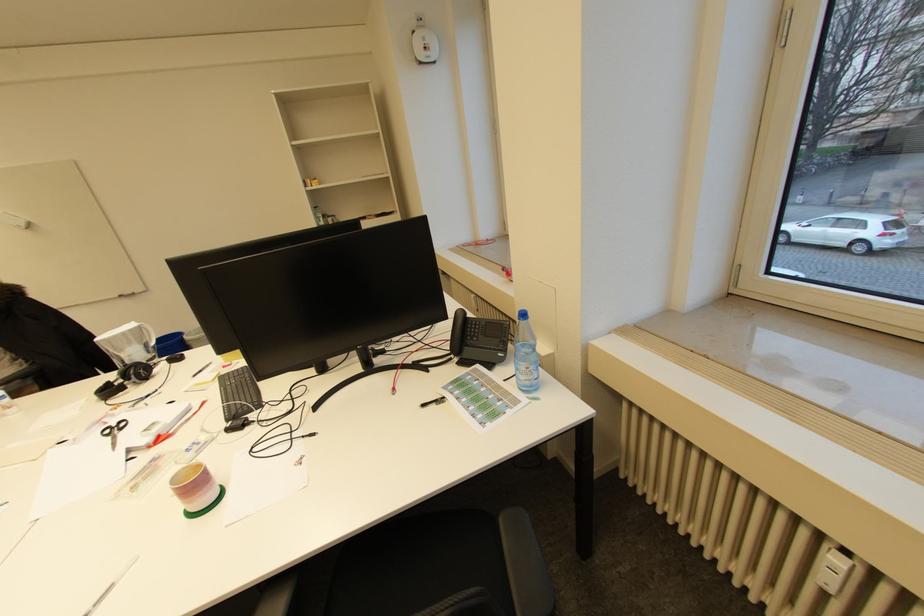
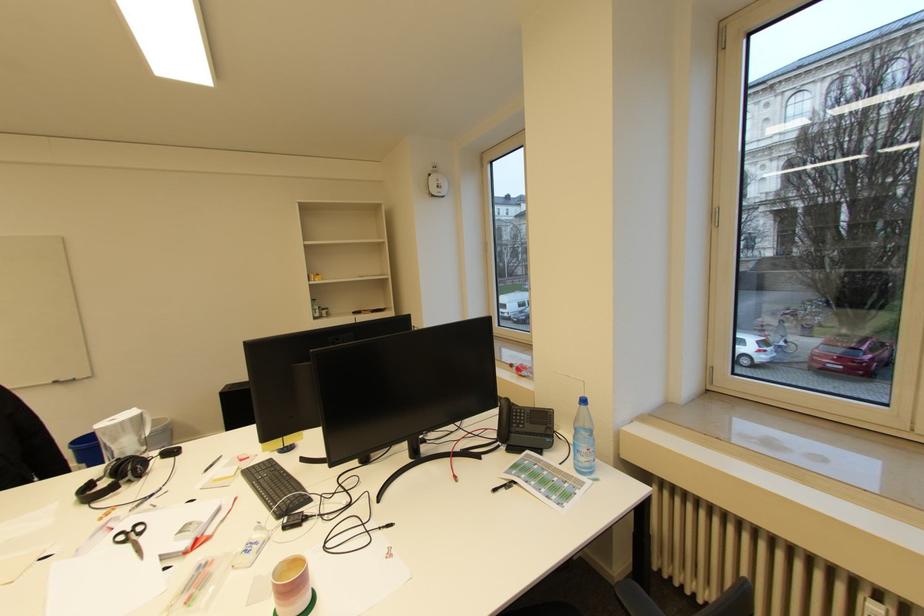
Where in the second image is the point corresponding to [477,331] from the first image?

(523, 419)